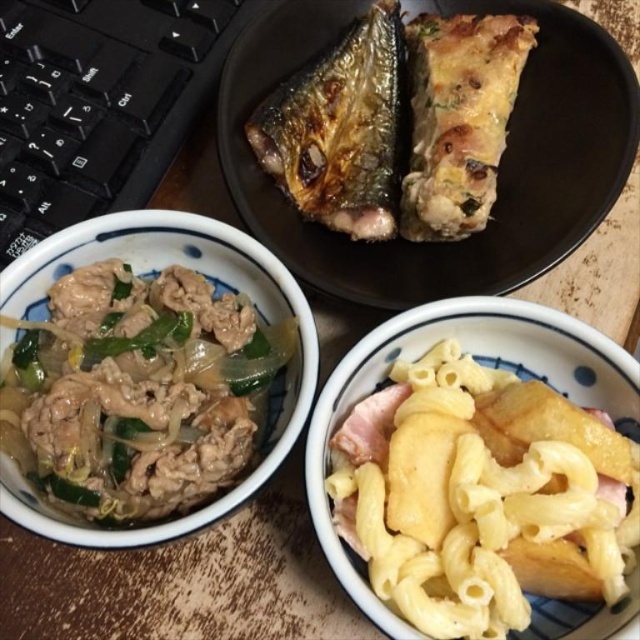
Question: Can you confirm if black matte plate at upper center is smaller than grilled fish at upper center?

Choices:
 (A) no
 (B) yes

Answer: (A)

Question: Does yellow matte pasta at lower right have a greater width compared to slightly translucent glass bowl at center?

Choices:
 (A) yes
 (B) no

Answer: (B)

Question: Does black matte plate at upper center have a lesser width compared to grilled fish at upper center?

Choices:
 (A) no
 (B) yes

Answer: (A)

Question: Which object appears closest to the camera in this image?

Choices:
 (A) black matte plate at upper center
 (B) grilled fish at upper center
 (C) slightly translucent glass bowl at center

Answer: (C)

Question: Estimate the real-world distances between objects in this image. Which object is closer to the slightly translucent glass bowl at center?

Choices:
 (A) black matte plate at upper center
 (B) grilled fish at upper center
 (C) yellow matte pasta at lower right

Answer: (C)

Question: Among these points, which one is nearest to the camera?

Choices:
 (A) 330,52
 (B) 294,396
 (C) 632,524
 (D) 278,193

Answer: (C)